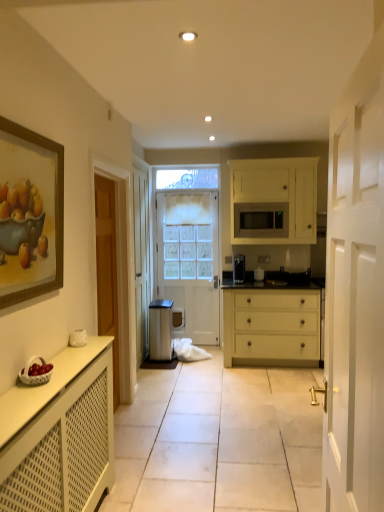
Question: From the image's perspective, is gold-framed painting at upper left beneath metallic trash bin at center?

Choices:
 (A) no
 (B) yes

Answer: (A)

Question: Does gold-framed painting at upper left have a lesser height compared to metallic trash bin at center?

Choices:
 (A) no
 (B) yes

Answer: (A)

Question: Is gold-framed painting at upper left with metallic trash bin at center?

Choices:
 (A) no
 (B) yes

Answer: (A)

Question: Is gold-framed painting at upper left closer to the viewer compared to metallic trash bin at center?

Choices:
 (A) no
 (B) yes

Answer: (B)

Question: Can you confirm if gold-framed painting at upper left is bigger than metallic trash bin at center?

Choices:
 (A) yes
 (B) no

Answer: (B)

Question: Is gold-framed painting at upper left outside metallic trash bin at center?

Choices:
 (A) yes
 (B) no

Answer: (A)

Question: Does white matte radiator at lower left, which is counted as the 1th cabinetry, starting from the bottom, have a greater height compared to black glossy sink at center?

Choices:
 (A) yes
 (B) no

Answer: (A)

Question: From a real-world perspective, is white matte radiator at lower left, the 2th cabinetry viewed from the right, physically above black glossy sink at center?

Choices:
 (A) yes
 (B) no

Answer: (B)

Question: Is there a large distance between white matte radiator at lower left, the 1th cabinetry positioned from the left, and black glossy sink at center?

Choices:
 (A) no
 (B) yes

Answer: (B)

Question: Is white matte radiator at lower left, which appears as the first cabinetry when viewed from the front, further to camera compared to black glossy sink at center?

Choices:
 (A) yes
 (B) no

Answer: (B)

Question: Can you see white matte radiator at lower left, the second cabinetry positioned from the back, touching black glossy sink at center?

Choices:
 (A) yes
 (B) no

Answer: (B)

Question: From a real-world perspective, is white matte radiator at lower left, which is the second cabinetry in top-to-bottom order, located beneath black glossy sink at center?

Choices:
 (A) yes
 (B) no

Answer: (A)

Question: Can you confirm if matte black coffee maker at center is thinner than white matte radiator at lower left, the second cabinetry positioned from the back?

Choices:
 (A) yes
 (B) no

Answer: (A)